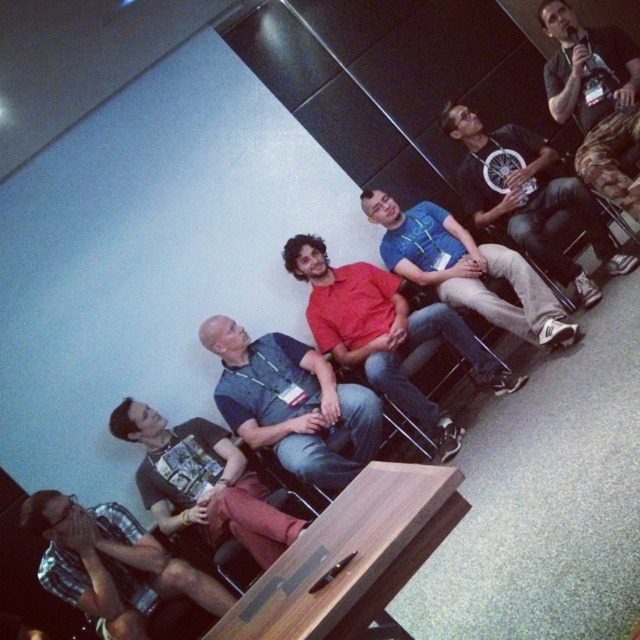
You are standing in the conference room and want to hand a document to both the dark gray shirt at center and the matte black shirt at upper right. Which person should you approach first to ensure you can reach them without moving past the other?

You should approach the dark gray shirt at center first because they are closer to you than the matte black shirt at upper right, which is further away.